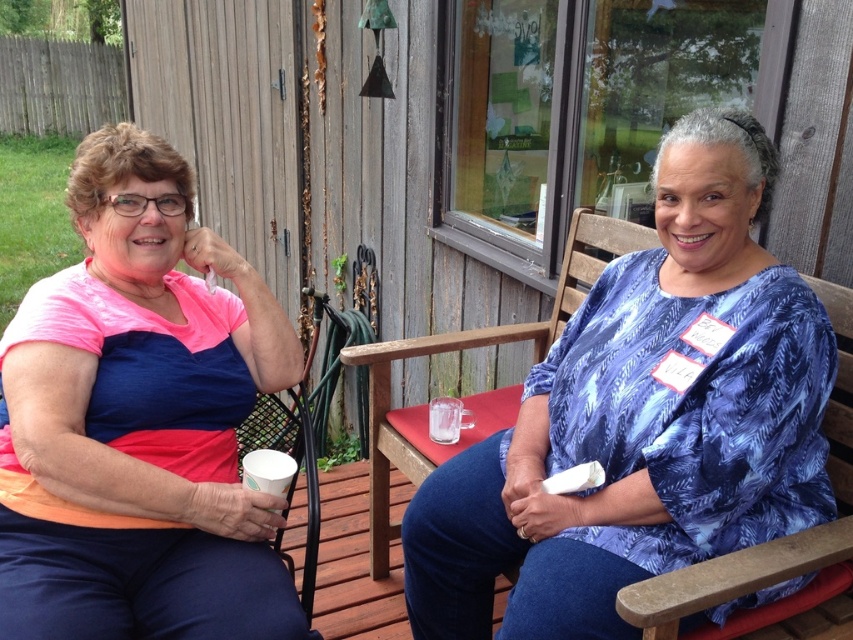
Can you confirm if wooden chair at center is positioned below wooden chair at right?

No.

Can you confirm if wooden chair at center is smaller than wooden chair at right?

Incorrect, wooden chair at center is not smaller in size than wooden chair at right.

Who is more forward, (432, 448) or (825, 566)?

Point (825, 566) is in front.

At what (x,y) coordinates should I click in order to perform the action: click on wooden chair at center. Please return your answer as a coordinate pair (x, y). This screenshot has height=640, width=853. Looking at the image, I should click on (479, 392).

Can you confirm if wooden chair at right is shorter than transparent glass cup at center?

In fact, wooden chair at right may be taller than transparent glass cup at center.

Who is more distant from viewer, (650, 628) or (450, 419)?

The point (450, 419) is more distant.

Locate an element on the screen. wooden chair at right is located at coordinates (730, 577).

Who is positioned more to the left, blue printed blouse at center or wooden chair at center?

From the viewer's perspective, wooden chair at center appears more on the left side.

Measure the distance from blue printed blouse at center to wooden chair at center.

They are 19.05 inches apart.

Identify the location of blue printed blouse at center. The width and height of the screenshot is (853, 640). point(642,419).

Identify the location of blue printed blouse at center. The image size is (853, 640). (642, 419).